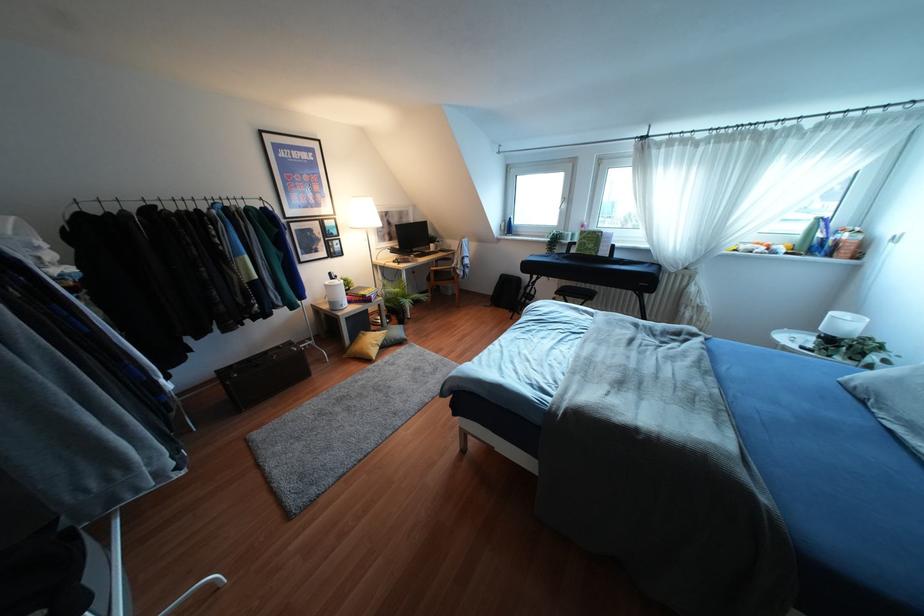
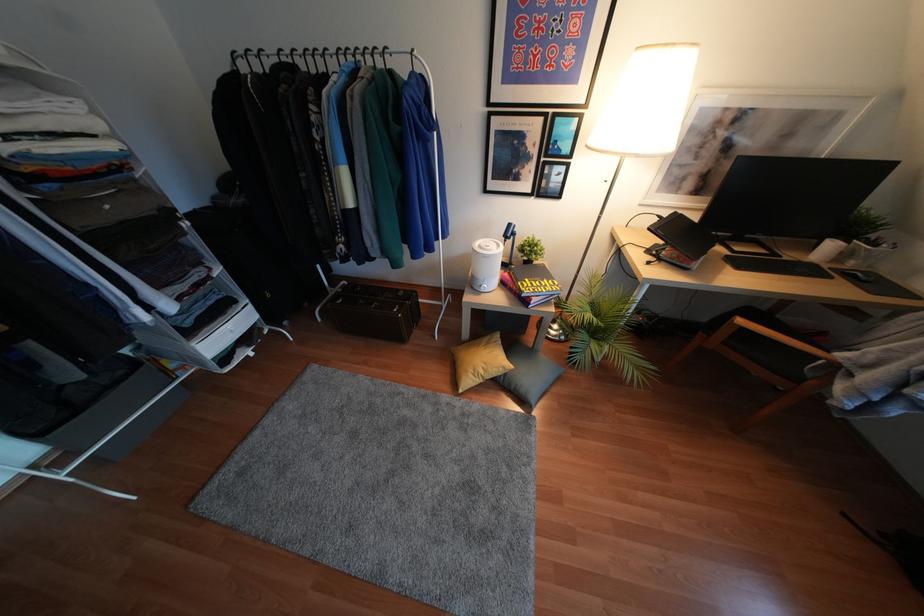
In the second image, find the point that corresponds to point 411,300 in the first image.

(604, 357)